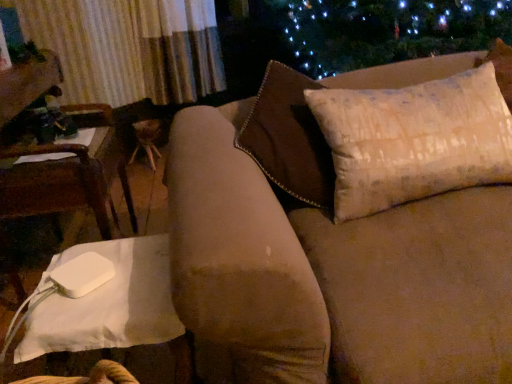
Question: Could you tell me if beige textured pillow at upper right is facing white fabric chair at left?

Choices:
 (A) yes
 (B) no

Answer: (B)

Question: Does beige textured pillow at upper right come in front of white fabric chair at left?

Choices:
 (A) no
 (B) yes

Answer: (B)

Question: Is white fabric chair at left completely or partially inside beige textured pillow at upper right?

Choices:
 (A) no
 (B) yes

Answer: (A)

Question: From the image's perspective, would you say beige textured pillow at upper right is shown under white fabric chair at left?

Choices:
 (A) yes
 (B) no

Answer: (B)

Question: Can we say beige textured pillow at upper right lies outside white fabric chair at left?

Choices:
 (A) no
 (B) yes

Answer: (B)

Question: Considering the relative positions of beige textured pillow at upper right and white fabric chair at left in the image provided, is beige textured pillow at upper right behind white fabric chair at left?

Choices:
 (A) yes
 (B) no

Answer: (B)

Question: From a real-world perspective, does white fabric chair at left stand above white fabric table at lower left?

Choices:
 (A) yes
 (B) no

Answer: (A)

Question: From a real-world perspective, is white fabric chair at left positioned under white fabric table at lower left based on gravity?

Choices:
 (A) no
 (B) yes

Answer: (A)

Question: Is white fabric chair at left in front of white fabric table at lower left?

Choices:
 (A) no
 (B) yes

Answer: (A)

Question: Is white fabric chair at left looking in the opposite direction of white fabric table at lower left?

Choices:
 (A) no
 (B) yes

Answer: (A)

Question: From the image's perspective, is white fabric chair at left above white fabric table at lower left?

Choices:
 (A) yes
 (B) no

Answer: (A)

Question: From the image's perspective, does white fabric chair at left appear lower than white fabric table at lower left?

Choices:
 (A) no
 (B) yes

Answer: (A)

Question: From the image's perspective, would you say white fabric chair at left is positioned over beige textured pillow at upper right?

Choices:
 (A) yes
 (B) no

Answer: (B)